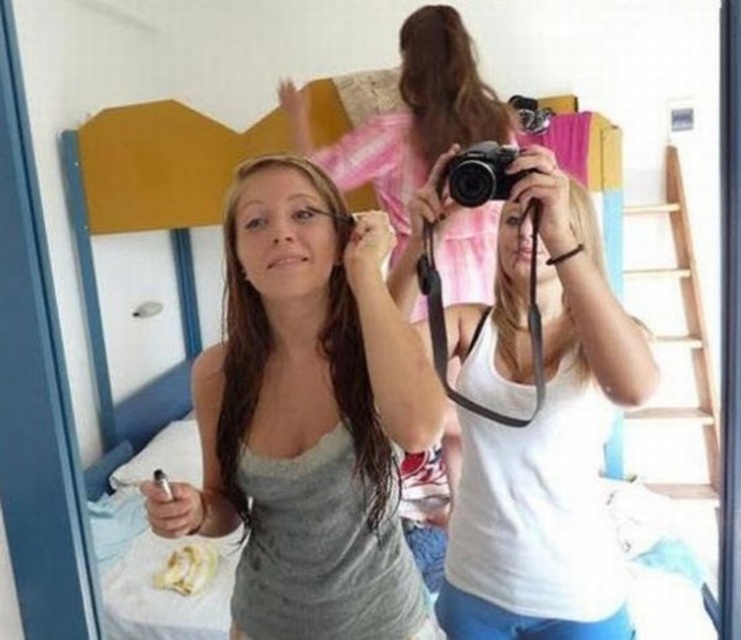
What is located at the coordinates point (308, 417)?

The gray matte tank top at center is located at point (308, 417).

You are trying to decide which item is taller between the gray matte tank top at center and the black plastic camera at center. Based on the scene, which one is taller?

The gray matte tank top at center is taller than the black plastic camera at center.